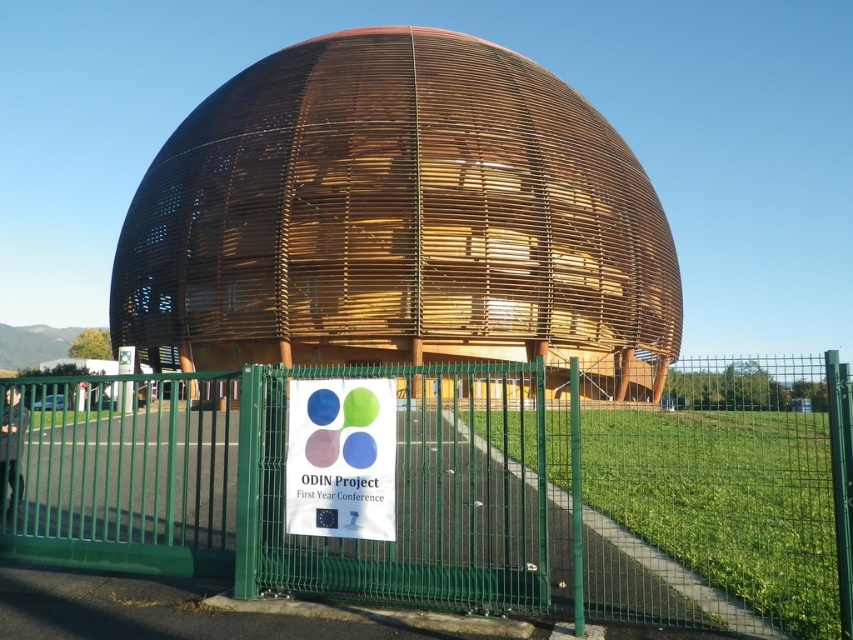
You are a GUI agent. You are given a task and a screenshot of the screen. Output one action in this format:
    pyautogui.click(x=<x>, y=<y>)
    Task: Click on the green metal fence at center
    
    Given the screenshot: What is the action you would take?
    pyautogui.click(x=457, y=486)

Can you confirm if green metal fence at center is taller than wooden at center?

In fact, green metal fence at center may be shorter than wooden at center.

Between point (195, 518) and point (165, 360), which one is positioned in front?

Point (195, 518) is in front.

The height and width of the screenshot is (640, 853). I want to click on green metal fence at center, so click(457, 486).

Is green metal fence at center wider than matte plastic sign at center?

Yes.

What do you see at coordinates (457, 486) in the screenshot? The image size is (853, 640). I see `green metal fence at center` at bounding box center [457, 486].

Is point (392, 401) positioned before point (294, 504)?

Yes.

The image size is (853, 640). What are the coordinates of `green metal fence at center` in the screenshot? It's located at (457, 486).

Who is shorter, wooden at center or matte plastic sign at center?

Standing shorter between the two is matte plastic sign at center.

Between wooden at center and matte plastic sign at center, which one is positioned higher?

wooden at center is higher up.

This screenshot has height=640, width=853. Describe the element at coordinates (398, 220) in the screenshot. I see `wooden at center` at that location.

You are a GUI agent. You are given a task and a screenshot of the screen. Output one action in this format:
    pyautogui.click(x=<x>, y=<y>)
    Task: Click on the wooden at center
    The image size is (853, 640).
    Given the screenshot: What is the action you would take?
    pyautogui.click(x=398, y=220)